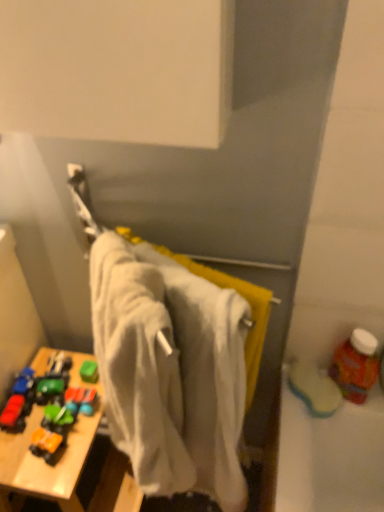
Find the location of `translucent plastic bottle at right`. translucent plastic bottle at right is located at coordinates (355, 365).

How far apart are white cotton towel at center and wooden toy at lower left?

white cotton towel at center and wooden toy at lower left are 12.99 inches apart from each other.

Which is behind, white cotton towel at center or wooden toy at lower left?

wooden toy at lower left is further from the camera.

Does point (205, 362) come behind point (38, 366)?

No.

The image size is (384, 512). I want to click on bath towel that appears above the rubberized plastic toy car at lower left (from the image's perspective), so click(170, 371).

How many degrees apart are the facing directions of rubberized plastic toy car at lower left and white cotton towel at center?

51.4 degrees separate the facing orientations of rubberized plastic toy car at lower left and white cotton towel at center.

Is rubberized plastic toy car at lower left placed right next to white cotton towel at center?

No, rubberized plastic toy car at lower left is not in contact with white cotton towel at center.

From a real-world perspective, who is located higher, translucent plastic bottle at right or white cotton towel at center?

In real-world perspective, white cotton towel at center is above.

Is translucent plastic bottle at right positioned beyond the bounds of white cotton towel at center?

Yes, translucent plastic bottle at right is located beyond the bounds of white cotton towel at center.

Would you say translucent plastic bottle at right is to the left or to the right of white cotton towel at center in the picture?

translucent plastic bottle at right is to the right of white cotton towel at center.

You are a GUI agent. You are given a task and a screenshot of the screen. Output one action in this format:
    pyautogui.click(x=<x>, y=<y>)
    Task: Click on the bottle located underneath the white cotton towel at center (from a real-world perspective)
    Image resolution: width=384 pixels, height=512 pixels.
    Given the screenshot: What is the action you would take?
    pyautogui.click(x=355, y=365)

From a real-world perspective, does translucent plastic bottle at right stand above wooden toy at lower left?

Yes, from a real-world perspective, translucent plastic bottle at right is over wooden toy at lower left

Are translucent plastic bottle at right and wooden toy at lower left far apart?

No, translucent plastic bottle at right is not far from wooden toy at lower left.

Who is taller, translucent plastic bottle at right or wooden toy at lower left?

With more height is wooden toy at lower left.

Would you say translucent plastic bottle at right is inside or outside wooden toy at lower left?

translucent plastic bottle at right is located beyond the bounds of wooden toy at lower left.

Is white cotton towel at center facing away from rubberized plastic toy car at lower left?

No, white cotton towel at center's orientation is not away from rubberized plastic toy car at lower left.

Are white cotton towel at center and rubberized plastic toy car at lower left far apart?

That's not correct — white cotton towel at center is a little close to rubberized plastic toy car at lower left.

From a real-world perspective, is white cotton towel at center on top of rubberized plastic toy car at lower left?

Indeed, from a real-world perspective, white cotton towel at center stands above rubberized plastic toy car at lower left.

Relative to rubberized plastic toy car at lower left, is white cotton towel at center in front or behind?

white cotton towel at center is in front of rubberized plastic toy car at lower left.

How different are the orientations of rubberized plastic toy car at lower left and wooden toy at lower left in degrees?

The angle between the facing direction of rubberized plastic toy car at lower left and the facing direction of wooden toy at lower left is 1.56 degrees.

Considering the positions of point (16, 405) and point (6, 432), is point (16, 405) closer or farther from the camera than point (6, 432)?

Point (16, 405) is farther from the camera than point (6, 432).

Which object is further away from the camera taking this photo, rubberized plastic toy car at lower left or wooden toy at lower left?

rubberized plastic toy car at lower left is more distant.

The height and width of the screenshot is (512, 384). Identify the location of toy located above the wooden toy at lower left (from a real-world perspective). 13,413.

From the image's perspective, between wooden toy at lower left and white cotton towel at center, which one is located above?

white cotton towel at center is shown above in the image.

Locate an element on the screen. This screenshot has height=512, width=384. bath towel located on the right of wooden toy at lower left is located at coordinates (170, 371).

Is wooden toy at lower left aimed at white cotton towel at center?

No, wooden toy at lower left does not turn towards white cotton towel at center.

From a real-world perspective, is wooden toy at lower left under white cotton towel at center?

Indeed, from a real-world perspective, wooden toy at lower left is positioned beneath white cotton towel at center.

The image size is (384, 512). In order to click on bath towel located on the right of wooden toy at lower left in this screenshot , I will do `click(170, 371)`.

What are the coordinates of `toy on the left of white cotton towel at center` in the screenshot? It's located at (13, 413).

When comparing their distances from rubberized plastic toy car at lower left, does wooden toy at lower left or white cotton towel at center seem further?

white cotton towel at center is positioned further to the anchor rubberized plastic toy car at lower left.

From the picture: Estimate the real-world distances between objects in this image. Which object is closer to white cotton towel at center, rubberized plastic toy car at lower left or wooden toy at lower left?

Based on the image, wooden toy at lower left appears to be nearer to white cotton towel at center.

When comparing their distances from white cotton towel at center, does translucent plastic bottle at right or wooden toy at lower left seem further?

translucent plastic bottle at right is positioned further to the anchor white cotton towel at center.

Considering their positions, is wooden toy at lower left positioned closer to white cotton towel at center than translucent plastic bottle at right?

wooden toy at lower left lies closer to white cotton towel at center than the other object.

Estimate the real-world distances between objects in this image. Which object is further from wooden toy at lower left, rubberized plastic toy car at lower left or translucent plastic bottle at right?

translucent plastic bottle at right is further to wooden toy at lower left.

Estimate the real-world distances between objects in this image. Which object is closer to rubberized plastic toy car at lower left, translucent plastic bottle at right or wooden toy at lower left?

The object closer to rubberized plastic toy car at lower left is wooden toy at lower left.

Looking at the image, which one is located closer to translucent plastic bottle at right, wooden toy at lower left or white cotton towel at center?

The object closer to translucent plastic bottle at right is white cotton towel at center.

Considering their positions, is translucent plastic bottle at right positioned closer to white cotton towel at center than rubberized plastic toy car at lower left?

Among the two, translucent plastic bottle at right is located nearer to white cotton towel at center.

You are a GUI agent. You are given a task and a screenshot of the screen. Output one action in this format:
    pyautogui.click(x=<x>, y=<y>)
    Task: Click on the table between white cotton towel at center and rubberized plastic toy car at lower left from front to back
    Image resolution: width=384 pixels, height=512 pixels.
    Given the screenshot: What is the action you would take?
    pyautogui.click(x=45, y=464)

Locate an element on the screen. bath towel located between rubberized plastic toy car at lower left and translucent plastic bottle at right in the left-right direction is located at coordinates (170, 371).

Locate an element on the screen. bath towel between wooden toy at lower left and translucent plastic bottle at right in the horizontal direction is located at coordinates (170, 371).

This screenshot has height=512, width=384. I want to click on table situated between rubberized plastic toy car at lower left and translucent plastic bottle at right from left to right, so click(45, 464).